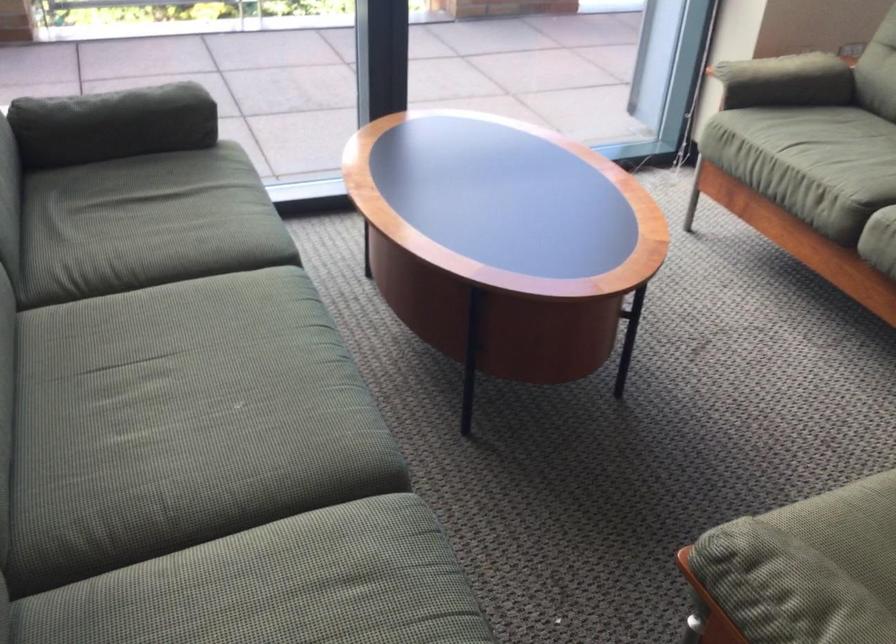
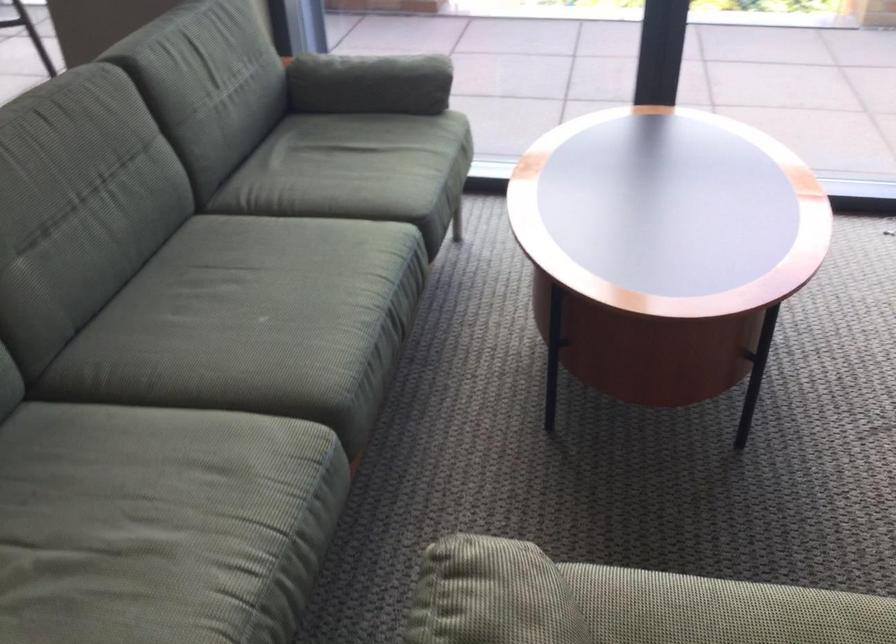
Question: How did the camera likely rotate?

Choices:
 (A) Left
 (B) Right
 (C) Up
 (D) Down

Answer: (A)